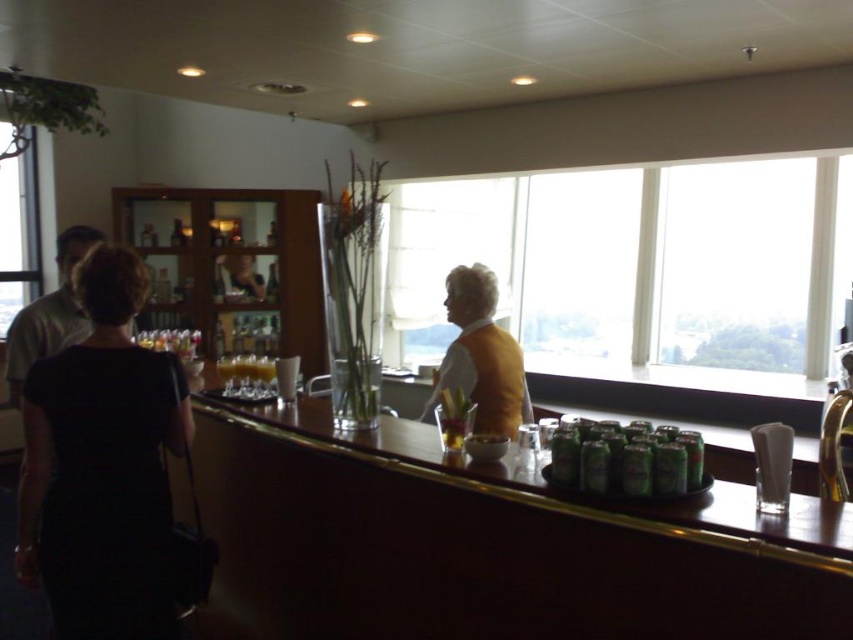
You are a bartender who needs to reach the tray with green cans on the counter. There are two people in the way. Which person should you move around to get to the tray? The black dress at left or the matte gray shirt at left?

The black dress at left is in front of the matte gray shirt at left, so you should move around the black dress at left first to reach the tray with green cans.

You are standing at the bar counter and want to pick up an item. There are two points marked on the counter at coordinates point (106, 508) and point (57, 352). Which point is closer to you?

Answer: Point (106, 508) is closer to the camera than point (57, 352), so the point closer to you is point (106, 508).